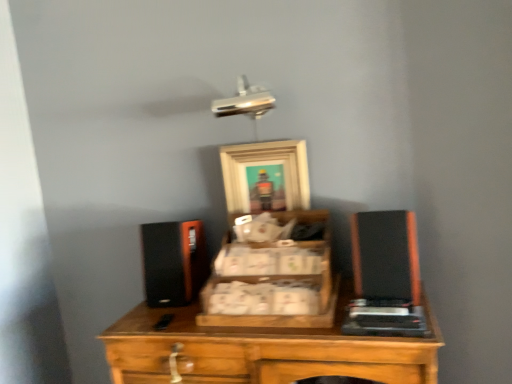
The height and width of the screenshot is (384, 512). I want to click on wooden picture frame at center, so click(265, 176).

What do you see at coordinates (385, 256) in the screenshot? Image resolution: width=512 pixels, height=384 pixels. I see `black matte speaker at right` at bounding box center [385, 256].

What are the coordinates of `wooden picture frame at center` in the screenshot? It's located at (265, 176).

Which of these two, wooden crate at center or wooden picture frame at center, is thinner?

Thinner between the two is wooden picture frame at center.

From a real-world perspective, does wooden crate at center sit lower than wooden picture frame at center?

Yes, from a real-world perspective, wooden crate at center is under wooden picture frame at center.

Which is behind, point (279, 266) or point (289, 141)?

The point (289, 141) is more distant.

In the scene shown: Is wooden crate at center completely or partially outside of wooden picture frame at center?

Yes, wooden crate at center is not within wooden picture frame at center.

Is black matte speaker at right spatially inside wooden picture frame at center, or outside of it?

black matte speaker at right is not inside wooden picture frame at center, it's outside.

Relative to wooden picture frame at center, is black matte speaker at right in front or behind?

black matte speaker at right is positioned closer to the viewer than wooden picture frame at center.

Is black matte speaker at right far away from wooden picture frame at center?

Actually, black matte speaker at right and wooden picture frame at center are a little close together.

Can wooden crate at center be found inside black matte speaker at right?

No, wooden crate at center is not inside black matte speaker at right.

Are black matte speaker at right and wooden crate at center located far from each other?

No.

The width and height of the screenshot is (512, 384). In order to click on wide that appears behind the wooden crate at center in this screenshot , I will do `click(385, 256)`.

Looking at their sizes, would you say black matte speaker at right is wider or thinner than wooden crate at center?

black matte speaker at right is thinner than wooden crate at center.

Can you confirm if wooden picture frame at center is thinner than wooden crate at center?

Indeed, wooden picture frame at center has a lesser width compared to wooden crate at center.

Is wooden picture frame at center not inside wooden crate at center?

Yes.

In terms of height, does wooden picture frame at center look taller or shorter compared to wooden crate at center?

Considering their sizes, wooden picture frame at center has more height than wooden crate at center.

From a real-world perspective, is wooden picture frame at center physically above wooden crate at center?

Yes, from a real-world perspective, wooden picture frame at center is above wooden crate at center.

Looking at this image, is wooden crate at center far from black matte speaker at right?

Actually, wooden crate at center and black matte speaker at right are a little close together.

Can we say wooden crate at center lies outside black matte speaker at right?

Yes, wooden crate at center is outside of black matte speaker at right.

Where is `wide that appears above the wooden crate at center (from a real-world perspective)`? wide that appears above the wooden crate at center (from a real-world perspective) is located at coordinates (385, 256).

From a real-world perspective, is wooden crate at center under black matte speaker at right?

Yes, from a real-world perspective, wooden crate at center is under black matte speaker at right.

Between wooden picture frame at center and black matte speaker at right, which one is positioned behind?

wooden picture frame at center is further from the camera.

Is wooden picture frame at center not within black matte speaker at right?

That's correct, wooden picture frame at center is outside of black matte speaker at right.

The height and width of the screenshot is (384, 512). I want to click on picture frame that appears above the black matte speaker at right (from the image's perspective), so click(265, 176).

This screenshot has height=384, width=512. Identify the location of picture frame that appears above the wooden crate at center (from the image's perspective). (265, 176).

Find the location of a particular element. wide in front of the wooden picture frame at center is located at coordinates (385, 256).

From the image, which object appears to be farther from wooden crate at center, black matte speaker at right or wooden picture frame at center?

Among the two, wooden picture frame at center is located further to wooden crate at center.

Based on their spatial positions, is black matte speaker at right or wooden crate at center further from wooden picture frame at center?

Based on the image, black matte speaker at right appears to be further to wooden picture frame at center.

Which object lies further to the anchor point black matte speaker at right, wooden picture frame at center or wooden crate at center?

wooden picture frame at center lies further to black matte speaker at right than the other object.

Considering their positions, is wooden crate at center positioned closer to black matte speaker at right than wooden picture frame at center?

wooden crate at center lies closer to black matte speaker at right than the other object.

From the image, which object appears to be farther from wooden picture frame at center, wooden crate at center or black matte speaker at right?

black matte speaker at right lies further to wooden picture frame at center than the other object.

Based on their spatial positions, is wooden picture frame at center or black matte speaker at right closer to wooden crate at center?

black matte speaker at right lies closer to wooden crate at center than the other object.

Find the location of a particular element. The image size is (512, 384). drawer between wooden picture frame at center and black matte speaker at right from left to right is located at coordinates (271, 286).